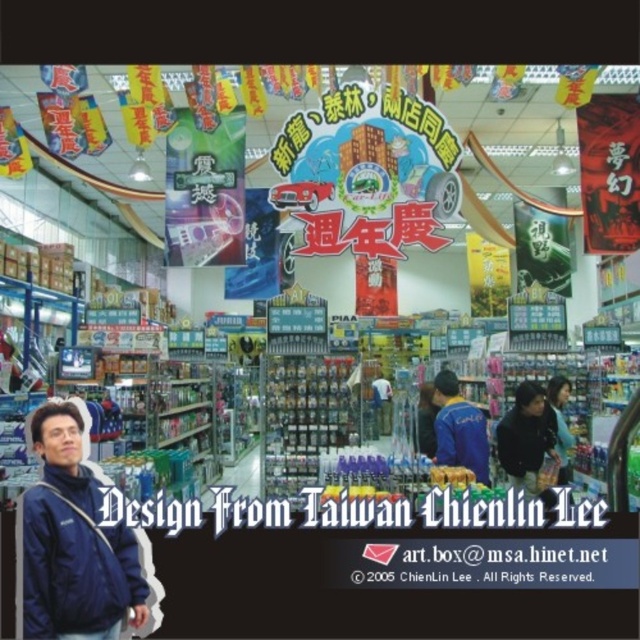
Question: Among these objects, which one is farthest from the camera?

Choices:
 (A) dark blue jacket at lower right
 (B) blue fabric jacket at lower left

Answer: (A)

Question: Which of the following is the farthest from the observer?

Choices:
 (A) blue fabric jacket at lower left
 (B) dark blue jacket at lower right

Answer: (B)

Question: Is dark blue jacket at center positioned before dark blue jacket at lower right?

Choices:
 (A) no
 (B) yes

Answer: (A)

Question: Is blue fabric jacket at lower left in front of dark blue jacket at center?

Choices:
 (A) yes
 (B) no

Answer: (A)

Question: Which point is closer to the camera taking this photo?

Choices:
 (A) (449, 451)
 (B) (557, 474)

Answer: (B)

Question: Is dark blue jacket at center thinner than blue fabric jacket at center?

Choices:
 (A) yes
 (B) no

Answer: (B)